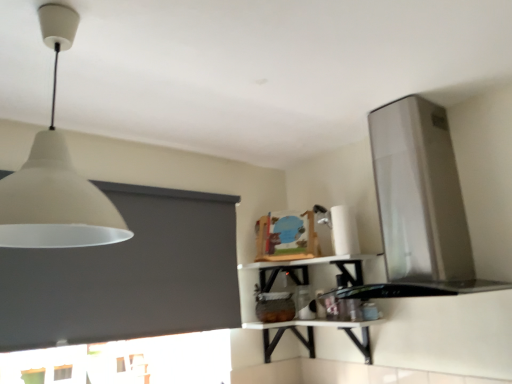
Question: Is satin silver vent at upper right far from white glossy shelf at upper center?

Choices:
 (A) yes
 (B) no

Answer: (B)

Question: From a real-world perspective, is satin silver vent at upper right over white glossy shelf at upper center?

Choices:
 (A) yes
 (B) no

Answer: (A)

Question: From a real-world perspective, is satin silver vent at upper right below white glossy shelf at upper center?

Choices:
 (A) no
 (B) yes

Answer: (A)

Question: Does satin silver vent at upper right lie behind white glossy shelf at upper center?

Choices:
 (A) yes
 (B) no

Answer: (B)

Question: Is satin silver vent at upper right not within white glossy shelf at upper center?

Choices:
 (A) yes
 (B) no

Answer: (A)

Question: Can you confirm if satin silver vent at upper right is positioned to the left of white glossy shelf at upper center?

Choices:
 (A) yes
 (B) no

Answer: (B)

Question: Is white matte lampshade at upper left surrounding satin silver vent at upper right?

Choices:
 (A) no
 (B) yes

Answer: (A)

Question: Considering the relative sizes of white matte lampshade at upper left and satin silver vent at upper right in the image provided, is white matte lampshade at upper left bigger than satin silver vent at upper right?

Choices:
 (A) yes
 (B) no

Answer: (B)

Question: Considering the relative sizes of white matte lampshade at upper left and satin silver vent at upper right in the image provided, is white matte lampshade at upper left wider than satin silver vent at upper right?

Choices:
 (A) yes
 (B) no

Answer: (B)

Question: Is white matte lampshade at upper left placed right next to satin silver vent at upper right?

Choices:
 (A) yes
 (B) no

Answer: (B)

Question: Can you confirm if white matte lampshade at upper left is positioned to the right of satin silver vent at upper right?

Choices:
 (A) yes
 (B) no

Answer: (B)

Question: Is the depth of white matte lampshade at upper left less than that of satin silver vent at upper right?

Choices:
 (A) yes
 (B) no

Answer: (A)

Question: Is white glossy shelf at upper center positioned with its back to white glossy table at center?

Choices:
 (A) no
 (B) yes

Answer: (A)